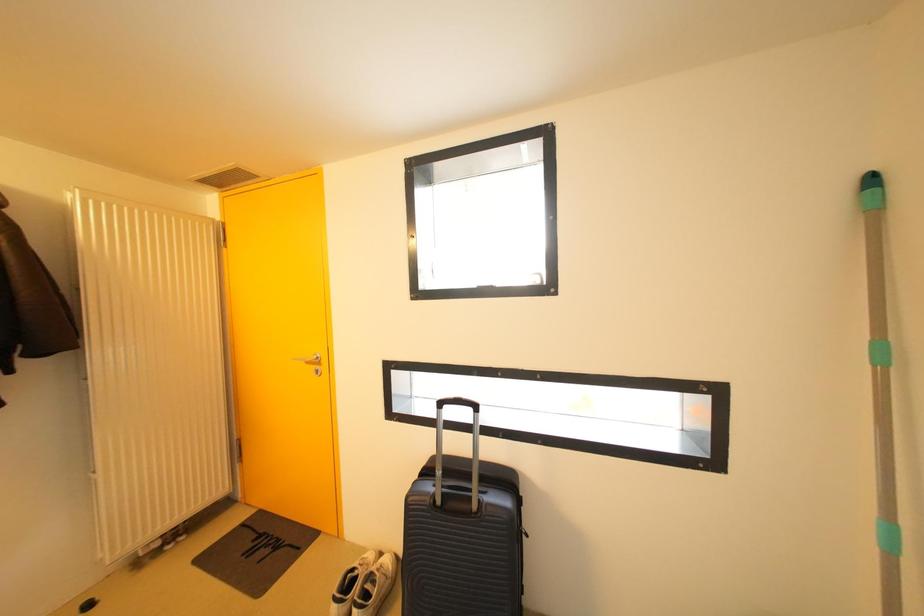
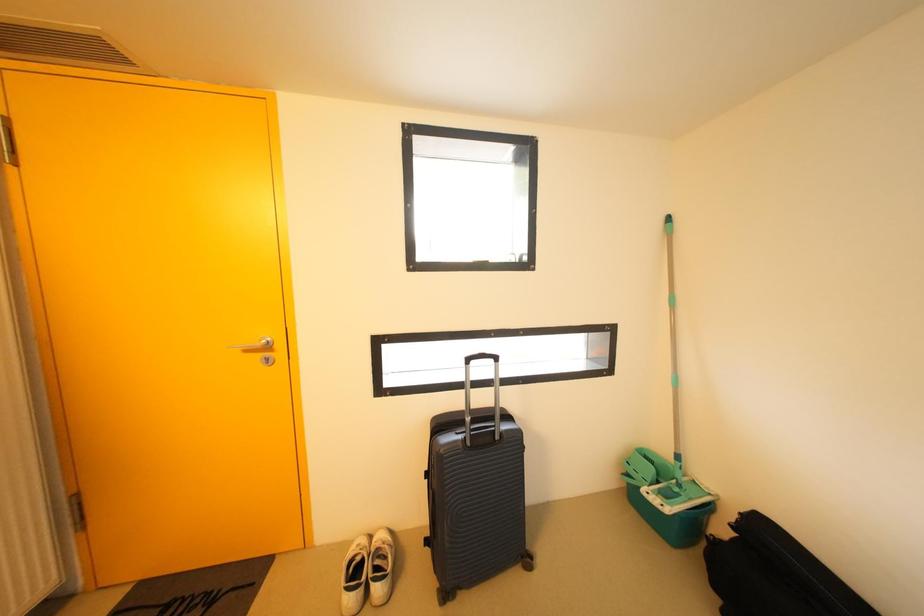
Question: In a continuous first-person perspective shot, in which direction is the camera moving?

Choices:
 (A) Left
 (B) Right
 (C) Forward
 (D) Backward

Answer: (A)